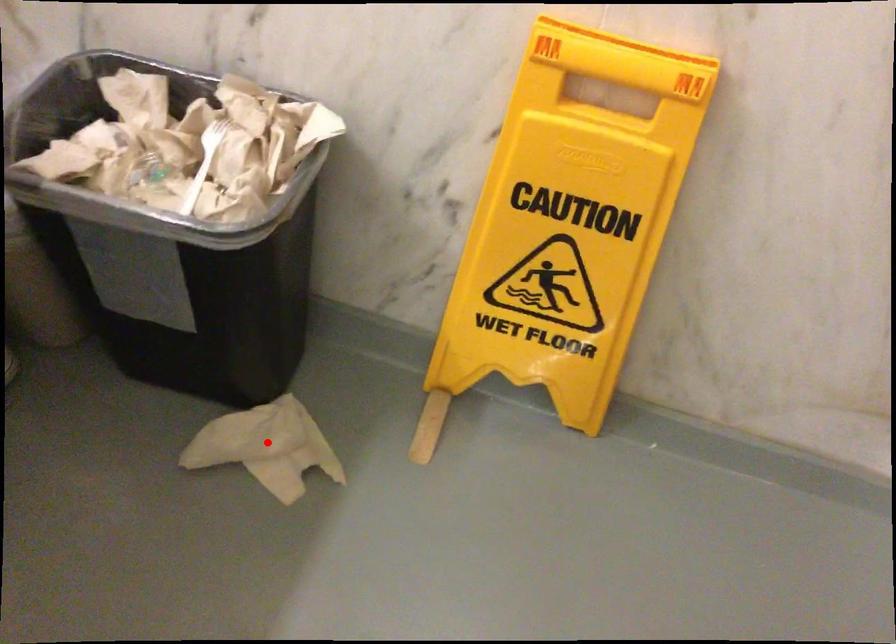
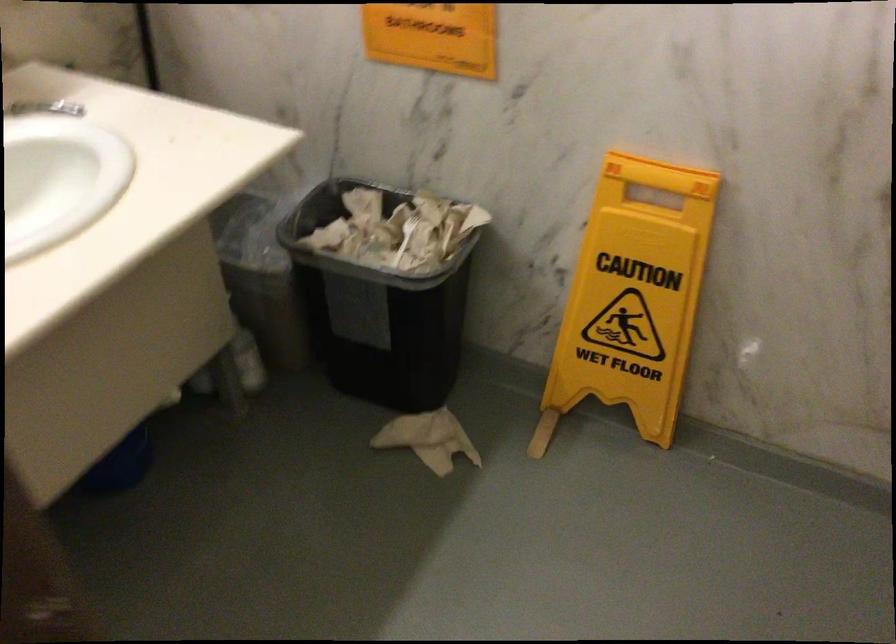
Where in the second image is the point corresponding to the highlighted location from the first image?

(428, 439)